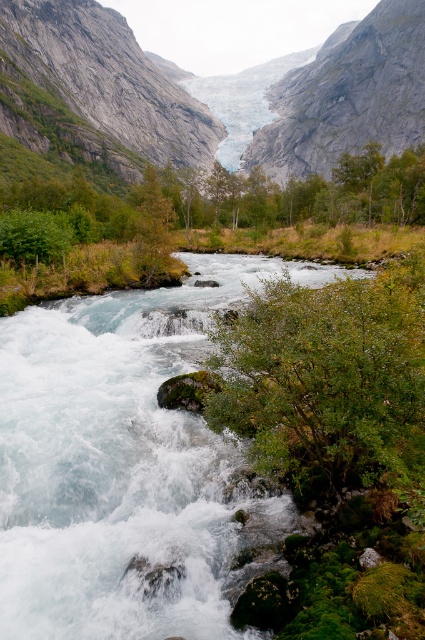
Is point (113, 76) farther from camera compared to point (289, 358)?

Yes, it is behind point (289, 358).

Which is behind, point (169, 120) or point (308, 401)?

Positioned behind is point (169, 120).

Identify the location of gray rock mountain at center. The height and width of the screenshot is (640, 425). (348, 96).